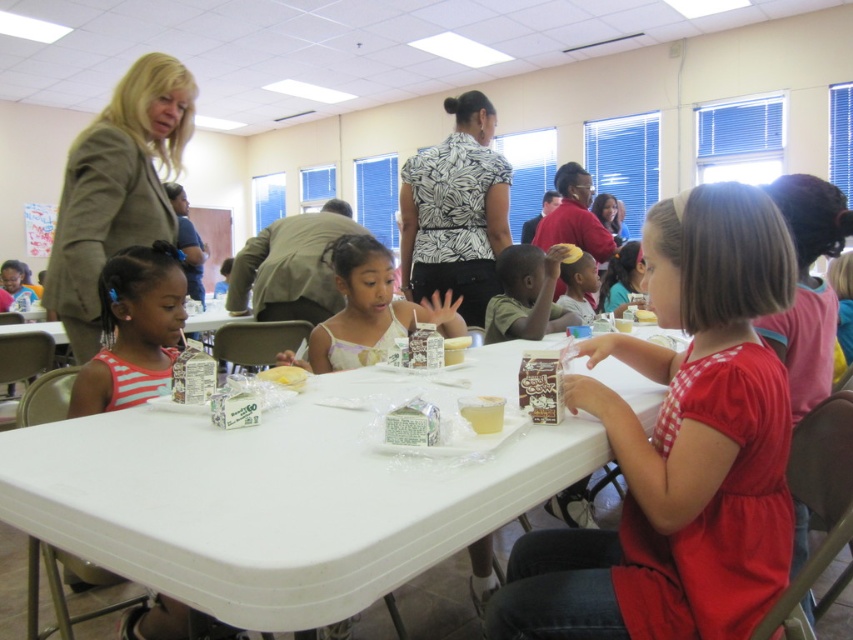
Can you confirm if white glossy cup at center is shorter than white paper cupcake at center?

No.

Between white glossy cup at center and white paper cupcake at center, which one has more height?

Standing taller between the two is white glossy cup at center.

The width and height of the screenshot is (853, 640). What do you see at coordinates (368, 310) in the screenshot? I see `white glossy cup at center` at bounding box center [368, 310].

The image size is (853, 640). What are the coordinates of `white glossy cup at center` in the screenshot? It's located at (368, 310).

Does green textured blazer at upper left have a smaller size compared to striped fabric shirt at left?

No.

Is green textured blazer at upper left thinner than striped fabric shirt at left?

Incorrect, green textured blazer at upper left's width is not less than striped fabric shirt at left's.

Find the location of a particular element. The width and height of the screenshot is (853, 640). green textured blazer at upper left is located at coordinates (115, 189).

Locate an element on the screen. green textured blazer at upper left is located at coordinates (115, 189).

Is matte red dress at center thinner than white glossy cup at center?

Correct, matte red dress at center's width is less than white glossy cup at center's.

Is point (670, 202) less distant than point (363, 300)?

Yes, point (670, 202) is closer to viewer.

Which is in front, point (721, 442) or point (392, 292)?

Point (721, 442) is in front.

Locate an element on the screen. The height and width of the screenshot is (640, 853). matte red dress at center is located at coordinates (680, 448).